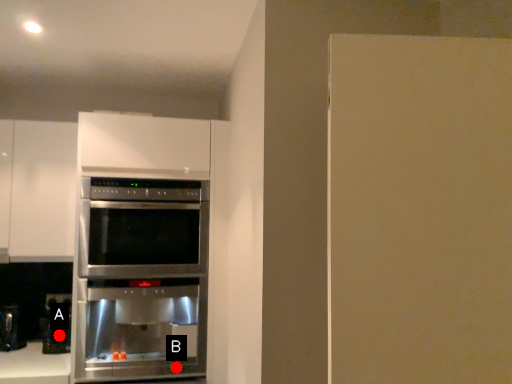
Question: Two points are circled on the image, labeled by A and B beside each circle. Which point is closer to the camera?

Choices:
 (A) A is closer
 (B) B is closer

Answer: (B)